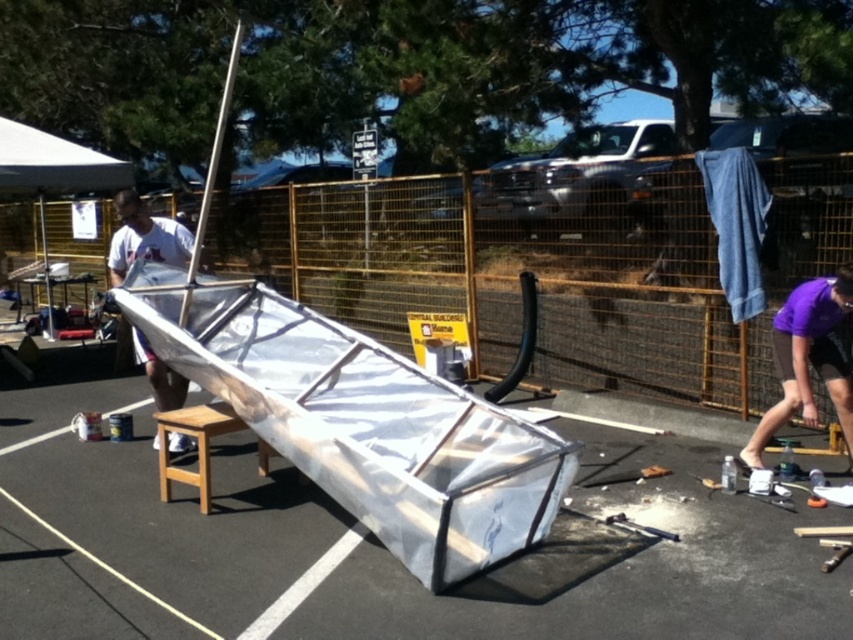
Who is more forward, (x=830, y=355) or (x=99, y=172)?

Point (x=830, y=355) is in front.

Is purple fabric at lower right positioned at the back of white fabric canopy at upper left?

No.

Where is `purple fabric at lower right`? This screenshot has height=640, width=853. purple fabric at lower right is located at coordinates (808, 358).

Locate an element on the screen. The width and height of the screenshot is (853, 640). purple fabric at lower right is located at coordinates (808, 358).

Does point (122, 275) come behind point (207, 472)?

That is True.

Is point (149, 234) less distant than point (206, 492)?

That is False.

The width and height of the screenshot is (853, 640). In order to click on white fabric sailboat at left in this screenshot , I will do `click(144, 237)`.

Looking at this image, who is lower down, purple fabric at lower right or light brown wooden stool at center?

Positioned lower is light brown wooden stool at center.

Based on the photo, does purple fabric at lower right have a smaller size compared to light brown wooden stool at center?

No.

Is point (845, 300) closer to camera compared to point (199, 458)?

Yes, it is.

Where is `purple fabric at lower right`? This screenshot has width=853, height=640. purple fabric at lower right is located at coordinates (808, 358).